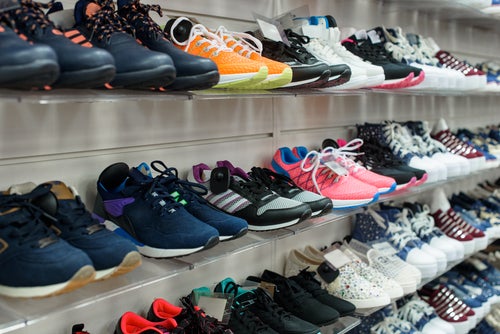
Find the location of a particular element. The height and width of the screenshot is (334, 500). shelf level is located at coordinates (163, 97), (184, 262), (351, 321), (477, 328).